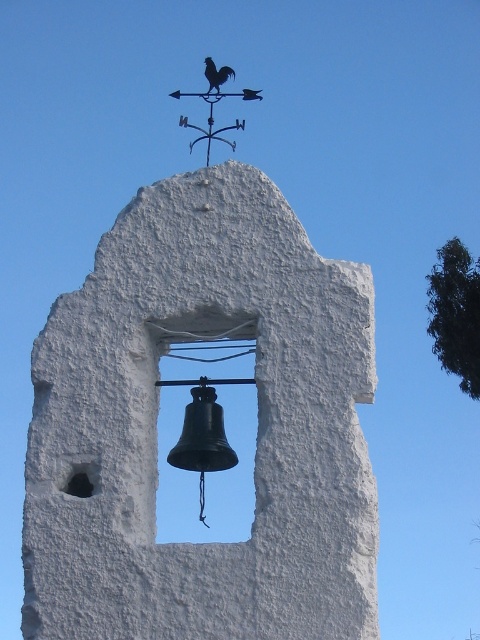
Question: Which of the following is the closest to the observer?

Choices:
 (A) pyautogui.click(x=196, y=93)
 (B) pyautogui.click(x=213, y=77)

Answer: (B)

Question: Does black metal weather vane at upper center appear under shiny black rooster at upper center?

Choices:
 (A) yes
 (B) no

Answer: (A)

Question: Can you confirm if black metal weather vane at upper center is positioned above shiny black rooster at upper center?

Choices:
 (A) yes
 (B) no

Answer: (B)

Question: Among these points, which one is nearest to the camera?

Choices:
 (A) (228, 67)
 (B) (228, 93)

Answer: (B)

Question: In this image, where is black metal weather vane at upper center located relative to shiny black rooster at upper center?

Choices:
 (A) right
 (B) left

Answer: (B)